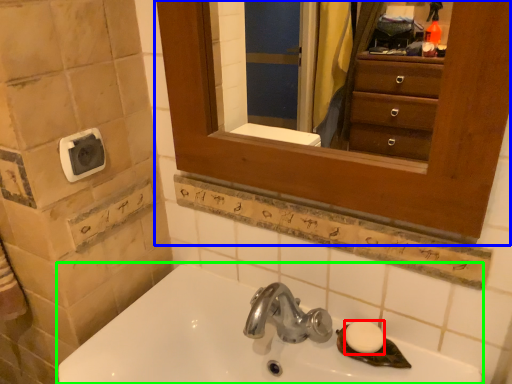
Question: Which object is the closest to the soap (highlighted by a red box)? Choose among these: medicine cabinet (highlighted by a blue box) or sink (highlighted by a green box).

Choices:
 (A) medicine cabinet
 (B) sink

Answer: (B)